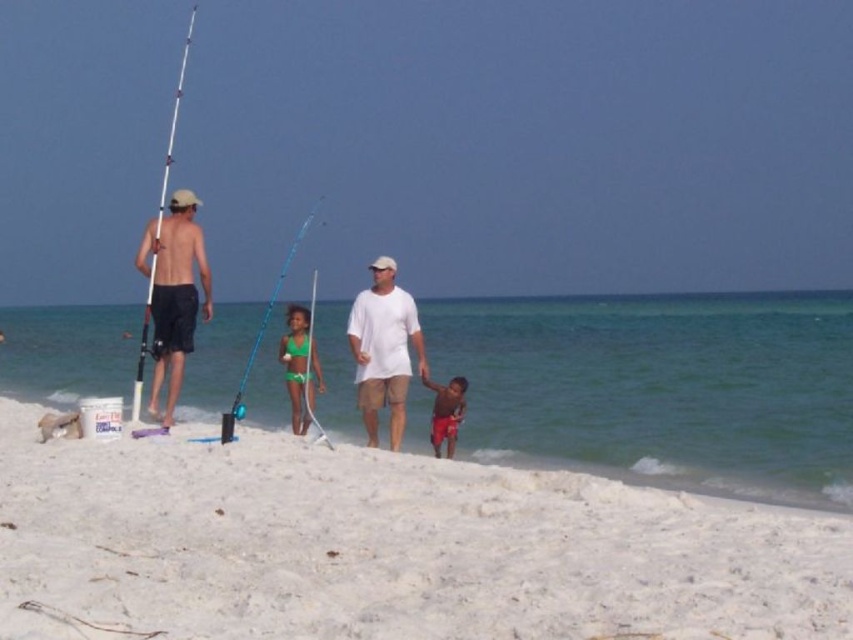
In the scene shown: Can you confirm if shiny black shorts at left is positioned above green swimsuit at center?

Yes, shiny black shorts at left is above green swimsuit at center.

Can you confirm if shiny black shorts at left is positioned below green swimsuit at center?

Incorrect, shiny black shorts at left is not positioned below green swimsuit at center.

Who is more distant from viewer, [177,314] or [303,416]?

Point [303,416]

You are a GUI agent. You are given a task and a screenshot of the screen. Output one action in this format:
    pyautogui.click(x=<x>, y=<y>)
    Task: Click on the shiny black shorts at left
    This screenshot has width=853, height=640.
    Given the screenshot: What is the action you would take?
    pyautogui.click(x=173, y=292)

How far apart are white cotton shirt at center and telescopic fiberglass fishing pole at left?

white cotton shirt at center is 102.45 feet from telescopic fiberglass fishing pole at left.

Which is above, white cotton shirt at center or telescopic fiberglass fishing pole at left?

telescopic fiberglass fishing pole at left is above.

You are a GUI agent. You are given a task and a screenshot of the screen. Output one action in this format:
    pyautogui.click(x=<x>, y=<y>)
    Task: Click on the white cotton shirt at center
    The height and width of the screenshot is (640, 853).
    Given the screenshot: What is the action you would take?
    coord(384,349)

In the scene shown: Is white cotton shirt at center closer to camera compared to bright red shorts at lower right?

Yes, white cotton shirt at center is in front of bright red shorts at lower right.

Who is positioned more to the right, white cotton shirt at center or bright red shorts at lower right?

From the viewer's perspective, bright red shorts at lower right appears more on the right side.

Where is `white cotton shirt at center`? white cotton shirt at center is located at coordinates (384, 349).